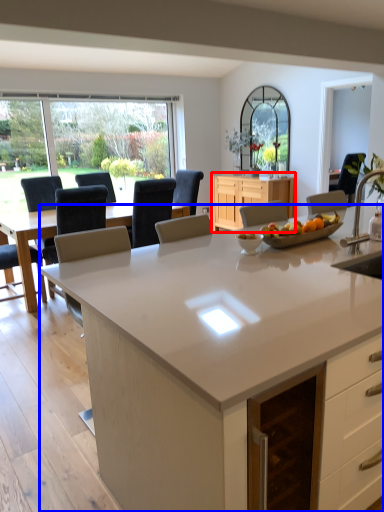
Question: Which object is further to the camera taking this photo, cabinetry (highlighted by a red box) or countertop (highlighted by a blue box)?

Choices:
 (A) cabinetry
 (B) countertop

Answer: (A)